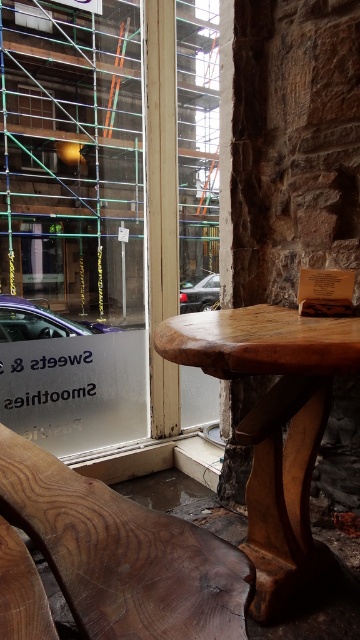
You are standing at the entrance of the cafe and want to walk towards the point at coordinates point (92,394) and point (294,424). Which point will you reach first?

You will reach point (294,424) first because it is closer to you than point (92,394), which is further away.

You are a delivery person standing at the entrance of the establishment. You need to place a package on the wooden table with the natural, curved edge in the foreground. Considering the transparent glass door at left is 7.31 feet away from you, can you reach the table without moving past the door?

The transparent glass door at left is 7.31 feet away from the camera, so yes, the delivery person can reach the wooden table with the natural, curved edge in the foreground without moving past the door since the distance is manageable.